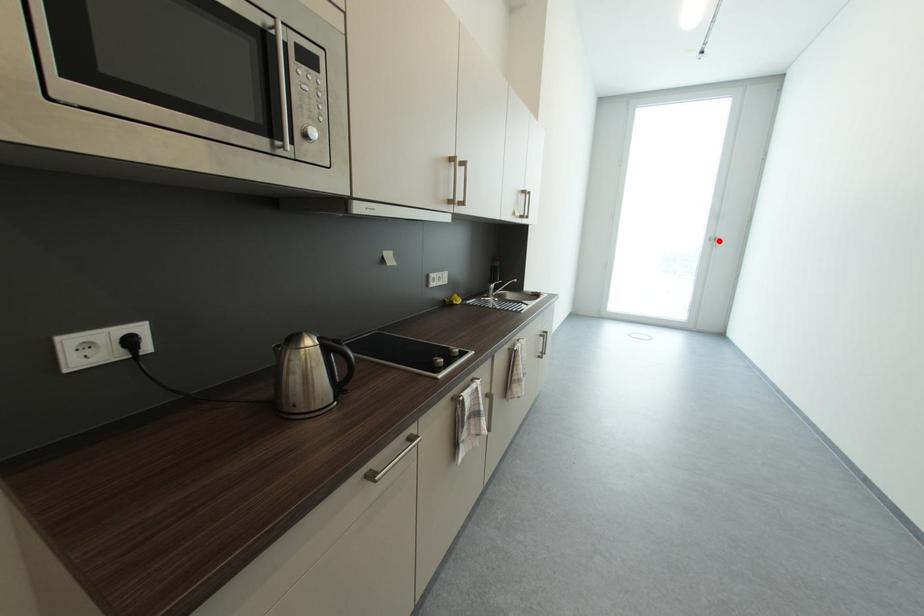
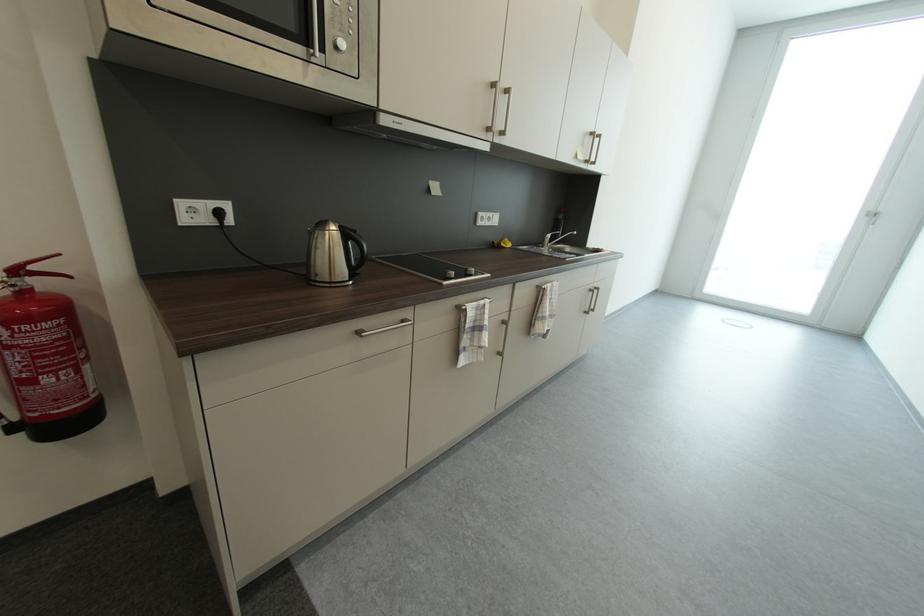
Locate, in the second image, the point that corresponds to the highlighted location in the first image.

(878, 217)